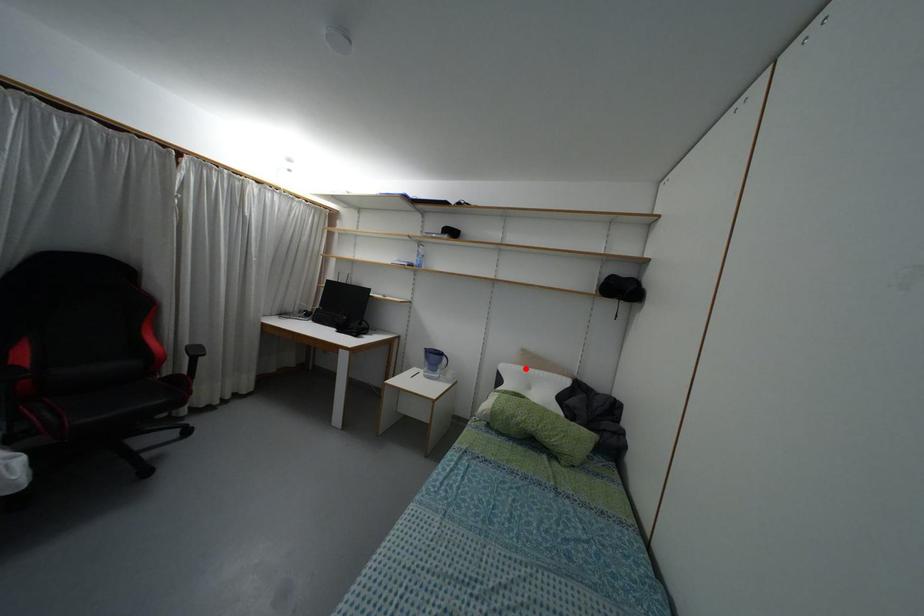
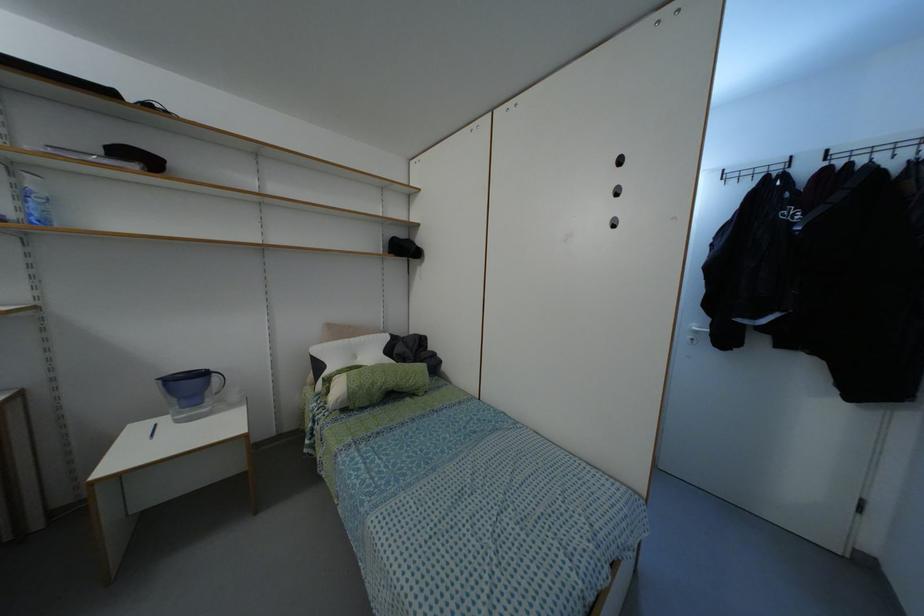
The point at the highlighted location is marked in the first image. Where is the corresponding point in the second image?

(345, 339)